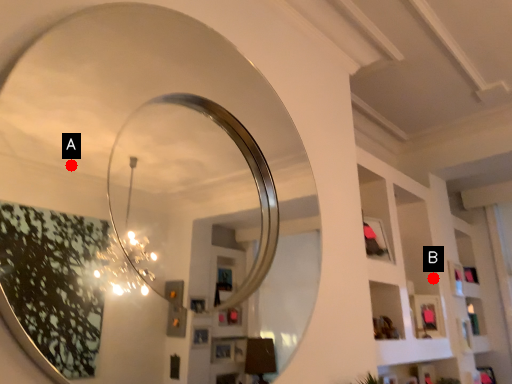
Question: Two points are circled on the image, labeled by A and B beside each circle. Which point is further to the camera?

Choices:
 (A) A is further
 (B) B is further

Answer: (A)